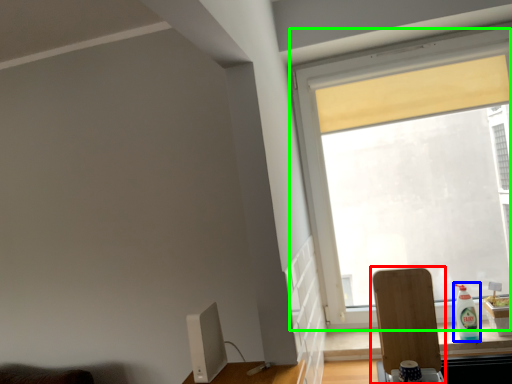
Question: Which is nearer to the swivel chair (highlighted by a red box)? bottle (highlighted by a blue box) or window (highlighted by a green box).

Choices:
 (A) bottle
 (B) window

Answer: (A)